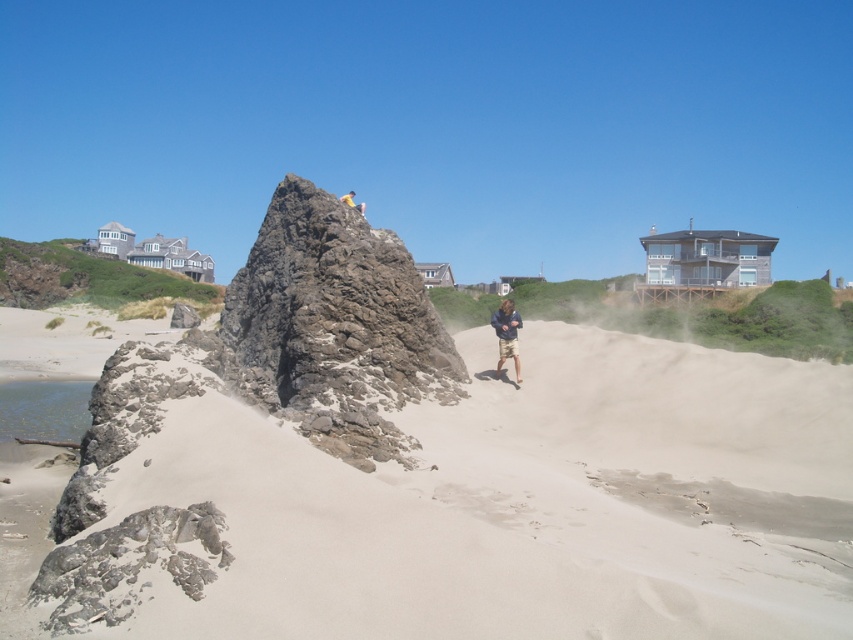
Does smooth beige sand at center have a lesser height compared to dark blue jacket at center?

In fact, smooth beige sand at center may be taller than dark blue jacket at center.

Find the location of a particular element. This screenshot has width=853, height=640. smooth beige sand at center is located at coordinates (460, 502).

The width and height of the screenshot is (853, 640). I want to click on smooth beige sand at center, so click(x=460, y=502).

Can you confirm if smooth beige sand at center is positioned below brown rough rock at center?

Yes.

Consider the image. Which is above, smooth beige sand at center or brown rough rock at center?

brown rough rock at center

At what (x,y) coordinates should I click in order to perform the action: click on smooth beige sand at center. Please return your answer as a coordinate pair (x, y). Looking at the image, I should click on (460, 502).

Does brown rough rock at center have a larger size compared to dark blue jacket at center?

Yes, brown rough rock at center is bigger than dark blue jacket at center.

Between brown rough rock at center and dark blue jacket at center, which one is positioned higher?

dark blue jacket at center is higher up.

Measure the distance between point (x=279, y=218) and camera.

Point (x=279, y=218) is 33.15 meters from camera.

You are a GUI agent. You are given a task and a screenshot of the screen. Output one action in this format:
    pyautogui.click(x=<x>, y=<y>)
    Task: Click on the brown rough rock at center
    
    Given the screenshot: What is the action you would take?
    pyautogui.click(x=334, y=326)